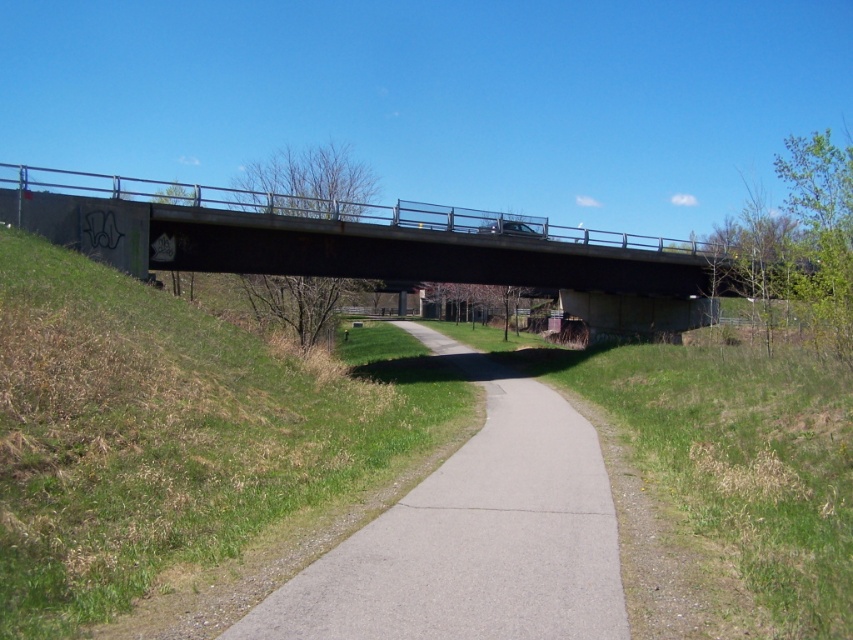
Question: Among these points, which one is nearest to the camera?

Choices:
 (A) (512, 636)
 (B) (850, 264)

Answer: (A)

Question: Does gray asphalt path at center appear on the left side of concrete bridge at upper center?

Choices:
 (A) no
 (B) yes

Answer: (B)

Question: Which of the following is the farthest from the observer?

Choices:
 (A) gray asphalt path at center
 (B) concrete bridge at upper center

Answer: (B)

Question: Can you confirm if gray asphalt path at center is thinner than concrete bridge at upper center?

Choices:
 (A) no
 (B) yes

Answer: (B)

Question: Is gray asphalt path at center positioned in front of concrete bridge at upper center?

Choices:
 (A) yes
 (B) no

Answer: (A)